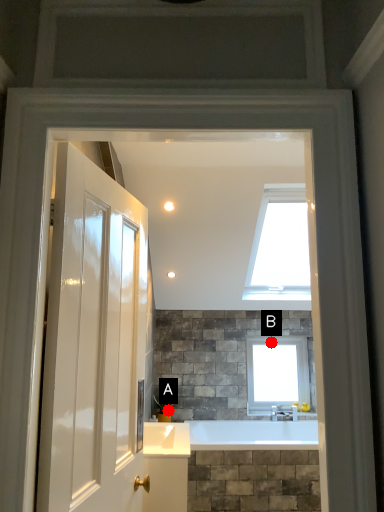
Question: Two points are circled on the image, labeled by A and B beside each circle. Which point is farther from the camera taking this photo?

Choices:
 (A) A is further
 (B) B is further

Answer: (B)